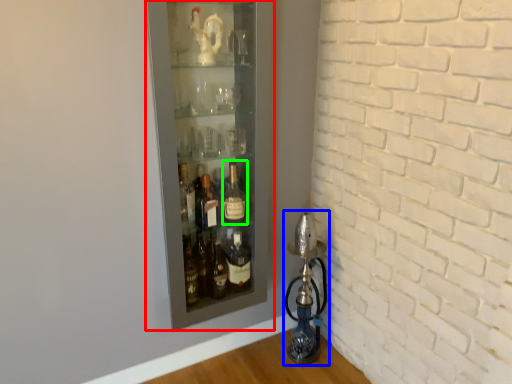
Question: Which object is positioned closest to shelf (highlighted by a red box)? Select from oil lamp (highlighted by a blue box) and bottle (highlighted by a green box).

Choices:
 (A) oil lamp
 (B) bottle

Answer: (B)